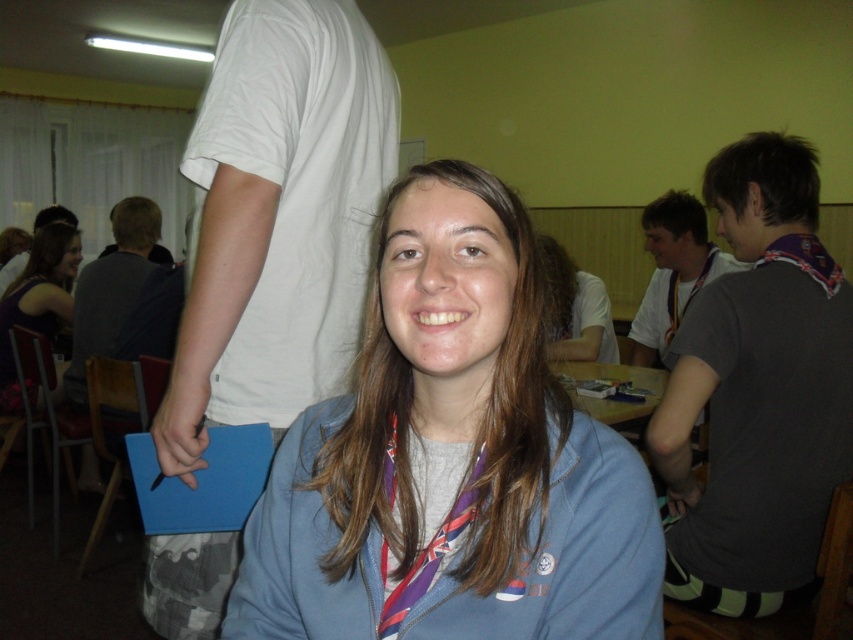
Question: Does blue fleece jacket at center come in front of wooden table at center?

Choices:
 (A) yes
 (B) no

Answer: (A)

Question: Does wooden table at center appear over purple fabric lanyard at upper right?

Choices:
 (A) yes
 (B) no

Answer: (B)

Question: Which point is closer to the camera taking this photo?

Choices:
 (A) (7, 385)
 (B) (384, 460)

Answer: (B)

Question: Which point is farther to the camera?

Choices:
 (A) dark gray t-shirt at right
 (B) purple silk scarf at center
 (C) wooden table at center

Answer: (C)

Question: Which object appears farthest from the camera in this image?

Choices:
 (A) purple silk scarf at center
 (B) dark gray t-shirt at right
 (C) white cotton t-shirt at upper left

Answer: (B)

Question: Does dark gray t-shirt at right appear on the left side of wooden table at center?

Choices:
 (A) yes
 (B) no

Answer: (B)